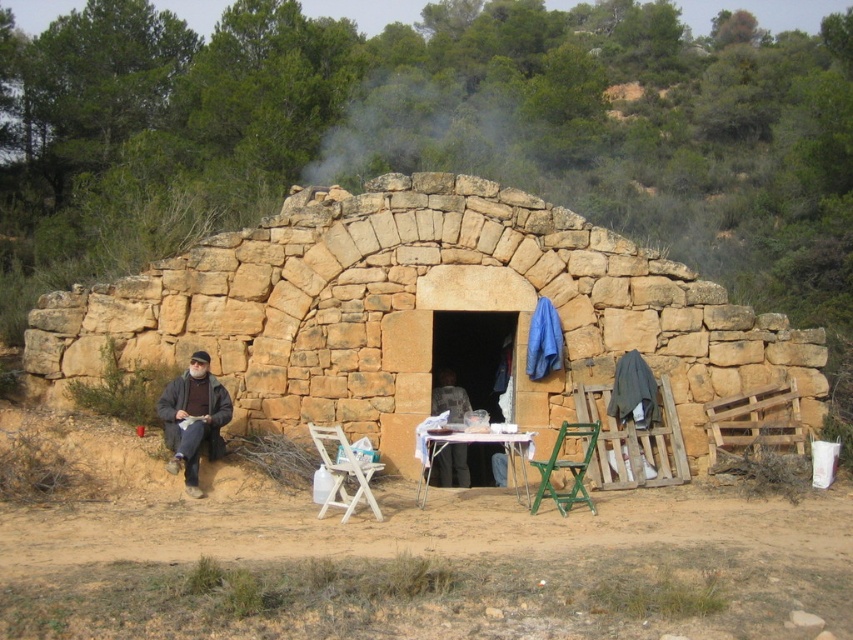
Question: Which of the following is the farthest from the observer?

Choices:
 (A) green plastic chair at lower center
 (B) white plastic table at center
 (C) dark brown leather jacket at center
 (D) natural stone hut at center

Answer: (C)

Question: Which point appears farthest from the camera in this image?

Choices:
 (A) (175, 380)
 (B) (334, 465)

Answer: (A)

Question: Is dark gray woolen sweater at left closer to the viewer compared to white plastic table at center?

Choices:
 (A) yes
 (B) no

Answer: (B)

Question: Does natural stone hut at center appear under white plastic table at center?

Choices:
 (A) yes
 (B) no

Answer: (A)

Question: Estimate the real-world distances between objects in this image. Which object is closer to the dark brown leather jacket at center?

Choices:
 (A) dark gray woolen sweater at left
 (B) white plastic table at center
 (C) white wood folding chair at lower center
 (D) green plastic chair at lower center

Answer: (B)

Question: Is dark gray woolen sweater at left positioned at the back of dark brown leather jacket at center?

Choices:
 (A) yes
 (B) no

Answer: (B)